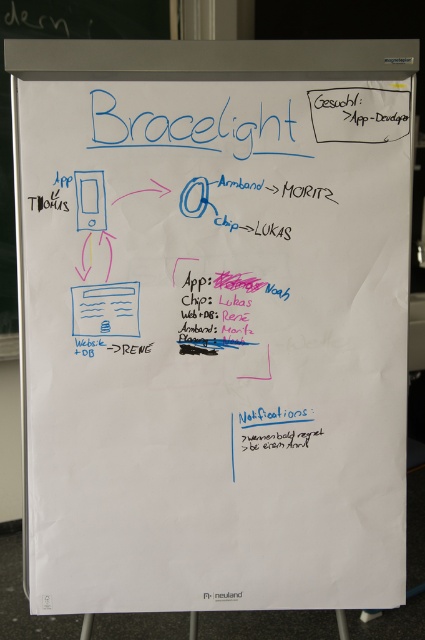
You are a developer looking to join the Bracelight project. You see the white paperboard at upper left and the matte white web page at center. Which object is closer to you?

The white paperboard at upper left is closer to you because the matte white web page at center is behind it.

You are standing in front of the whiteboard and want to locate the point at coordinates [10,96]. Where exactly on the whiteboard would this point be located?

The point at coordinates [10,96] is located at the upper left of the whiteboard, where the title Bracelight is written in large blue marker letters.